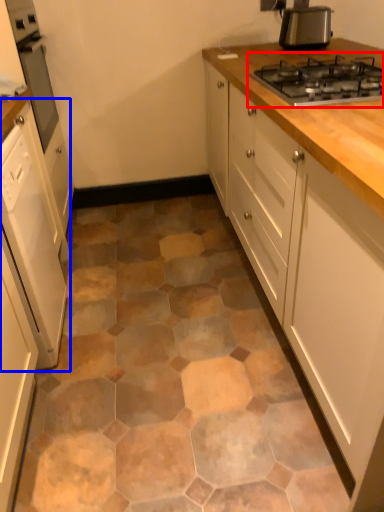
Question: Which object is closer to the camera taking this photo, gas stove (highlighted by a red box) or cabinetry (highlighted by a blue box)?

Choices:
 (A) gas stove
 (B) cabinetry

Answer: (B)